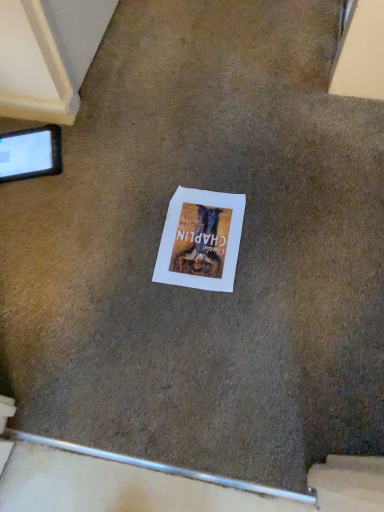
Question: Does black glossy tablet at upper left have a lesser height compared to white paper at center?

Choices:
 (A) yes
 (B) no

Answer: (B)

Question: Is black glossy tablet at upper left not within white paper at center?

Choices:
 (A) yes
 (B) no

Answer: (A)

Question: From a real-world perspective, is black glossy tablet at upper left beneath white paper at center?

Choices:
 (A) yes
 (B) no

Answer: (B)

Question: Is black glossy tablet at upper left thinner than white paper at center?

Choices:
 (A) yes
 (B) no

Answer: (A)

Question: Is black glossy tablet at upper left positioned before white paper at center?

Choices:
 (A) no
 (B) yes

Answer: (A)

Question: Is black glossy tablet at upper left behind white paper at center?

Choices:
 (A) yes
 (B) no

Answer: (A)

Question: Does white paper at center contain black glossy tablet at upper left?

Choices:
 (A) no
 (B) yes

Answer: (A)

Question: Is the depth of white paper at center greater than that of black glossy tablet at upper left?

Choices:
 (A) yes
 (B) no

Answer: (B)

Question: From a real-world perspective, is white paper at center beneath black glossy tablet at upper left?

Choices:
 (A) no
 (B) yes

Answer: (B)

Question: Is white paper at center positioned beyond the bounds of black glossy tablet at upper left?

Choices:
 (A) no
 (B) yes

Answer: (B)

Question: Are white paper at center and black glossy tablet at upper left beside each other?

Choices:
 (A) yes
 (B) no

Answer: (B)

Question: Is white paper at center smaller than black glossy tablet at upper left?

Choices:
 (A) no
 (B) yes

Answer: (B)

Question: Considering the positions of black glossy tablet at upper left and white paper at center in the image, is black glossy tablet at upper left bigger or smaller than white paper at center?

Choices:
 (A) small
 (B) big

Answer: (B)